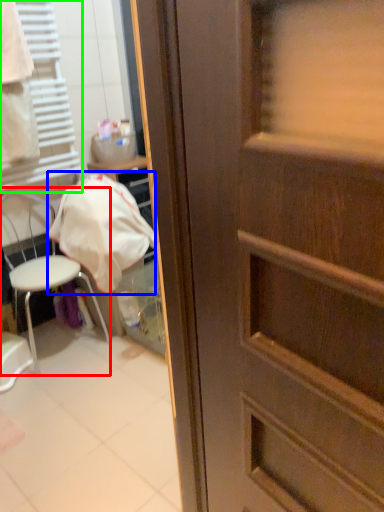
Question: Which object is the farthest from chair (highlighted by a red box)? Choose among these: blanket (highlighted by a blue box) or shutter (highlighted by a green box).

Choices:
 (A) blanket
 (B) shutter

Answer: (B)